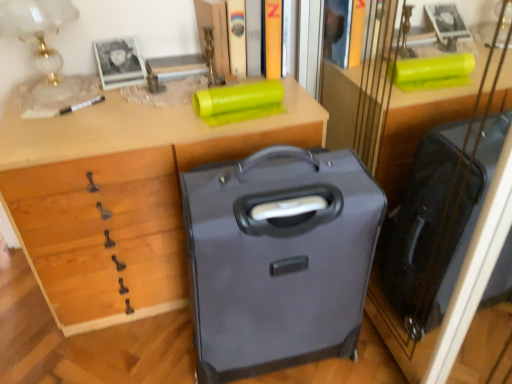
Find the location of `vacant space that is in between matte wood desk at center and matte gray suitcase at center`. vacant space that is in between matte wood desk at center and matte gray suitcase at center is located at coordinates pyautogui.click(x=139, y=352).